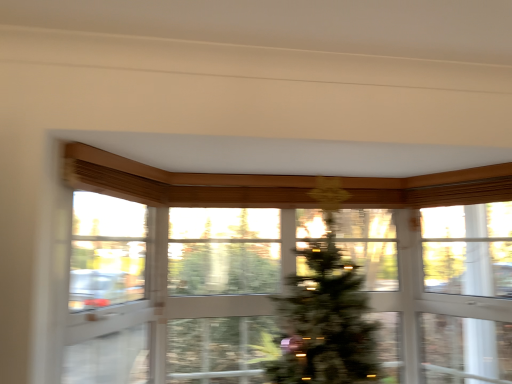
This screenshot has height=384, width=512. Describe the element at coordinates (181, 266) in the screenshot. I see `transparent glass window at center` at that location.

You are a GUI agent. You are given a task and a screenshot of the screen. Output one action in this format:
    pyautogui.click(x=<x>, y=<y>)
    Task: Click on the green matte christmas tree at center
    
    Given the screenshot: What is the action you would take?
    pyautogui.click(x=325, y=321)

This screenshot has height=384, width=512. I want to click on transparent glass window screen at upper right, so 468,249.

What are the coordinates of `transparent glass window at center` in the screenshot? It's located at (181, 266).

From a real-world perspective, which object stands above the other?

In real-world perspective, transparent glass window screen at upper right is above.

Considering the sizes of objects transparent glass window screen at upper right and green matte christmas tree at center in the image provided, who is thinner, transparent glass window screen at upper right or green matte christmas tree at center?

transparent glass window screen at upper right.

Could you tell me if transparent glass window screen at upper right is facing green matte christmas tree at center?

No, transparent glass window screen at upper right is not oriented towards green matte christmas tree at center.

Is transparent glass window screen at upper right not close to green matte christmas tree at center?

transparent glass window screen at upper right is far away from green matte christmas tree at center.

Between transparent glass screen door at left and green matte christmas tree at center, which one has larger size?

green matte christmas tree at center is bigger.

Measure the distance between transparent glass screen door at left and green matte christmas tree at center.

They are 33.83 inches apart.

Are transparent glass screen door at left and green matte christmas tree at center far apart?

No, transparent glass screen door at left is in close proximity to green matte christmas tree at center.

Image resolution: width=512 pixels, height=384 pixels. Find the location of `christmas tree below the transparent glass screen door at left (from the image's perspective)`. christmas tree below the transparent glass screen door at left (from the image's perspective) is located at coordinates (325, 321).

Would you say transparent glass window at center is a long distance from transparent glass screen door at left?

No, there isn't a large distance between transparent glass window at center and transparent glass screen door at left.

Could you tell me if transparent glass window at center is turned towards transparent glass screen door at left?

No, transparent glass window at center does not turn towards transparent glass screen door at left.

Is transparent glass window at center at the right side of transparent glass screen door at left?

Yes.

Which object is further away from the camera, transparent glass window at center or transparent glass screen door at left?

Positioned behind is transparent glass screen door at left.

In terms of height, does transparent glass window at center look taller or shorter compared to green matte christmas tree at center?

In the image, transparent glass window at center appears to be shorter than green matte christmas tree at center.

Is transparent glass window at center wider or thinner than green matte christmas tree at center?

transparent glass window at center is wider than green matte christmas tree at center.

Is point (505, 271) closer to viewer compared to point (393, 214)?

No, it is not.

Who is taller, transparent glass window screen at upper right or transparent glass window at center?

transparent glass window at center.

Considering the sizes of objects transparent glass window screen at upper right and transparent glass window at center in the image provided, who is wider, transparent glass window screen at upper right or transparent glass window at center?

With larger width is transparent glass window at center.

From the image's perspective, is transparent glass window screen at upper right beneath transparent glass window at center?

Actually, transparent glass window screen at upper right appears above transparent glass window at center in the image.

Is green matte christmas tree at center completely or partially outside of transparent glass window at center?

green matte christmas tree at center lies outside transparent glass window at center's area.

Considering the sizes of objects green matte christmas tree at center and transparent glass window at center in the image provided, who is thinner, green matte christmas tree at center or transparent glass window at center?

Thinner between the two is green matte christmas tree at center.

From a real-world perspective, who is located lower, green matte christmas tree at center or transparent glass window at center?

From a 3D spatial view, green matte christmas tree at center is below.

Considering the positions of objects green matte christmas tree at center and transparent glass window screen at upper right in the image provided, who is more to the right, green matte christmas tree at center or transparent glass window screen at upper right?

transparent glass window screen at upper right is more to the right.

Does green matte christmas tree at center lie in front of transparent glass window screen at upper right?

No, green matte christmas tree at center is further to the viewer.

Is green matte christmas tree at center facing towards transparent glass window screen at upper right?

No, green matte christmas tree at center is not turned towards transparent glass window screen at upper right.

Which of these two, green matte christmas tree at center or transparent glass window screen at upper right, stands taller?

green matte christmas tree at center.

At what (x,y) coordinates should I click in order to perform the action: click on christmas tree that is behind the transparent glass window screen at upper right. Please return your answer as a coordinate pair (x, y). Looking at the image, I should click on click(x=325, y=321).

I want to click on christmas tree below the transparent glass screen door at left (from a real-world perspective), so [325, 321].

Looking at the image, which one is located further to green matte christmas tree at center, transparent glass screen door at left or transparent glass window at center?

transparent glass screen door at left is positioned further to the anchor green matte christmas tree at center.

From the image, which object appears to be farther from transparent glass window at center, transparent glass screen door at left or transparent glass window screen at upper right?

transparent glass window screen at upper right is positioned further to the anchor transparent glass window at center.

Considering their positions, is transparent glass window at center positioned further to transparent glass screen door at left than transparent glass window screen at upper right?

Based on the image, transparent glass window screen at upper right appears to be further to transparent glass screen door at left.

Considering their positions, is transparent glass window screen at upper right positioned closer to transparent glass screen door at left than green matte christmas tree at center?

green matte christmas tree at center is closer to transparent glass screen door at left.

Based on their spatial positions, is transparent glass window screen at upper right or transparent glass screen door at left closer to green matte christmas tree at center?

Among the two, transparent glass screen door at left is located nearer to green matte christmas tree at center.

From the image, which object appears to be farther from transparent glass window screen at upper right, transparent glass screen door at left or transparent glass window at center?

Based on the image, transparent glass screen door at left appears to be further to transparent glass window screen at upper right.

In the scene shown: Which object lies further to the anchor point transparent glass window at center, transparent glass window screen at upper right or transparent glass screen door at left?

transparent glass window screen at upper right is further to transparent glass window at center.

Considering their positions, is green matte christmas tree at center positioned further to transparent glass screen door at left than transparent glass window screen at upper right?

The object further to transparent glass screen door at left is transparent glass window screen at upper right.

Image resolution: width=512 pixels, height=384 pixels. I want to click on screen door between transparent glass window at center and green matte christmas tree at center along the z-axis, so click(x=106, y=293).

Find the location of `window screen between transparent glass window at center and green matte christmas tree at center along the z-axis`. window screen between transparent glass window at center and green matte christmas tree at center along the z-axis is located at coordinates (468, 249).

Image resolution: width=512 pixels, height=384 pixels. I want to click on window between transparent glass screen door at left and transparent glass window screen at upper right from left to right, so click(x=181, y=266).

Locate an element on the screen. The image size is (512, 384). christmas tree between transparent glass screen door at left and transparent glass window screen at upper right is located at coordinates (325, 321).